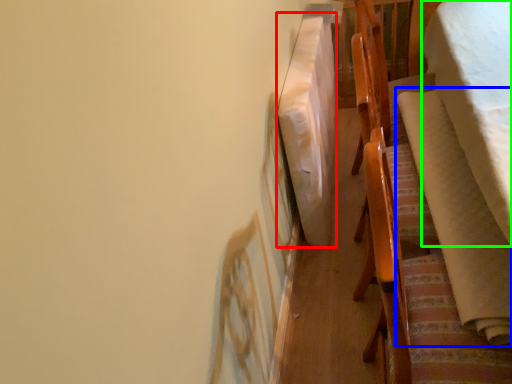
Question: Which object is positioned closest to blanket (highlighted by a red box)? Select from blanket (highlighted by a blue box) and blanket (highlighted by a green box).

Choices:
 (A) blanket
 (B) blanket

Answer: (A)